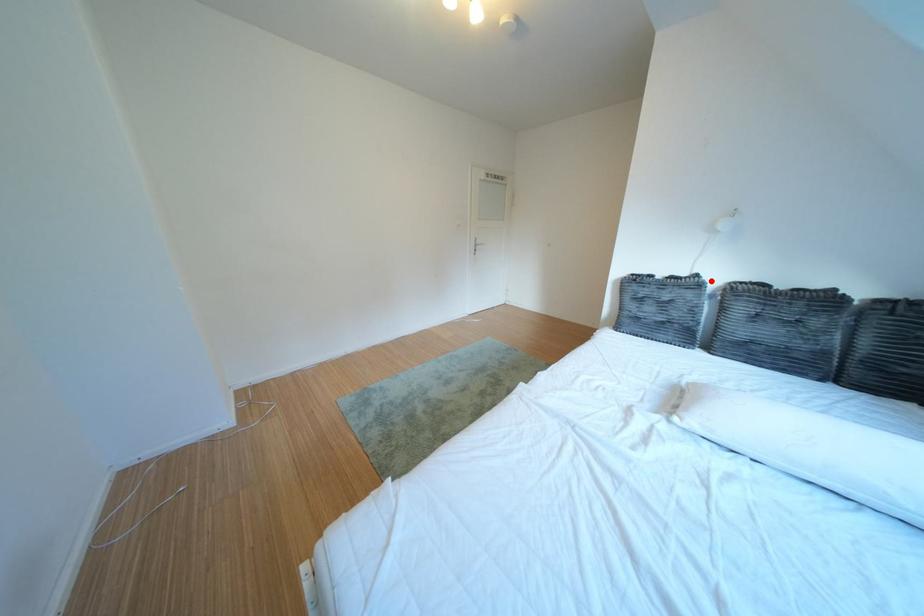
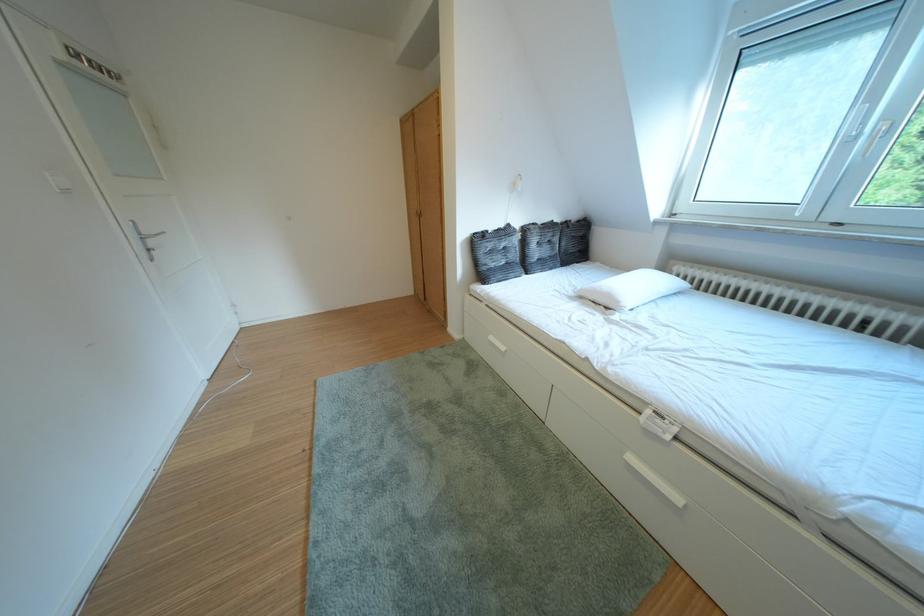
Question: I am providing you with two images of the same scene from different viewpoints. Image1 has a red point marked. In image2, the corresponding 3D location appears at what relative position? Reply with the corresponding letter.

Choices:
 (A) Closer
 (B) Farther

Answer: (A)